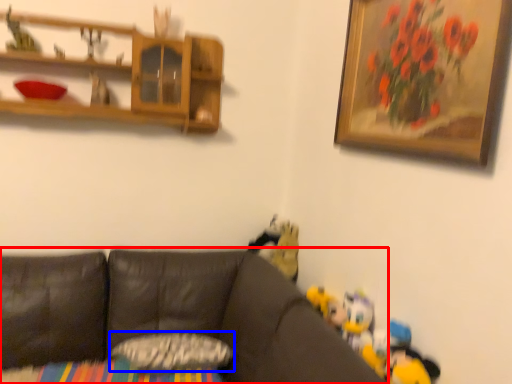
Question: Among these objects, which one is farthest to the camera, studio couch (highlighted by a red box) or pillow (highlighted by a blue box)?

Choices:
 (A) studio couch
 (B) pillow

Answer: (B)